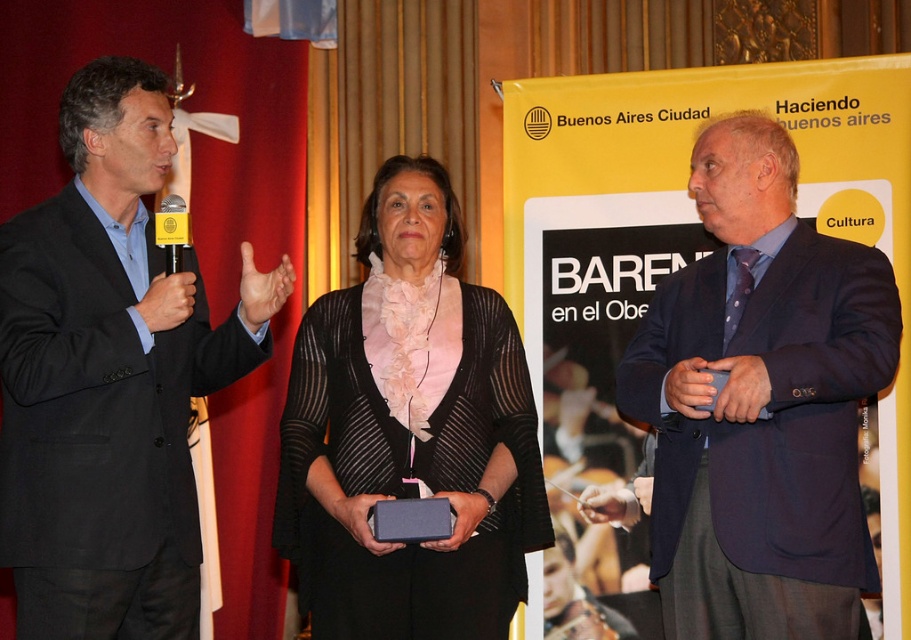
Does dark blue suit at center have a greater width compared to yellow plastic microphone at left?

Yes.

Is point (662, 500) farther from camera compared to point (172, 257)?

Yes, point (662, 500) is behind point (172, 257).

The height and width of the screenshot is (640, 911). I want to click on dark blue suit at center, so click(x=760, y=404).

Can you confirm if dark blue suit at center is shorter than matte black sweater at center?

Incorrect, dark blue suit at center's height does not fall short of matte black sweater at center's.

Does dark blue suit at center have a larger size compared to matte black sweater at center?

Actually, dark blue suit at center might be smaller than matte black sweater at center.

Does point (770, 577) come closer to viewer compared to point (435, 593)?

Yes, it is.

Identify the location of dark blue suit at center. This screenshot has height=640, width=911. (760, 404).

Between point (504, 381) and point (169, 209), which one is positioned behind?

The point (504, 381) is behind.

From the picture: Does matte black sweater at center appear on the left side of yellow plastic microphone at left?

In fact, matte black sweater at center is to the right of yellow plastic microphone at left.

Locate an element on the screen. matte black sweater at center is located at coordinates (408, 433).

Locate an element on the screen. matte black sweater at center is located at coordinates 408,433.